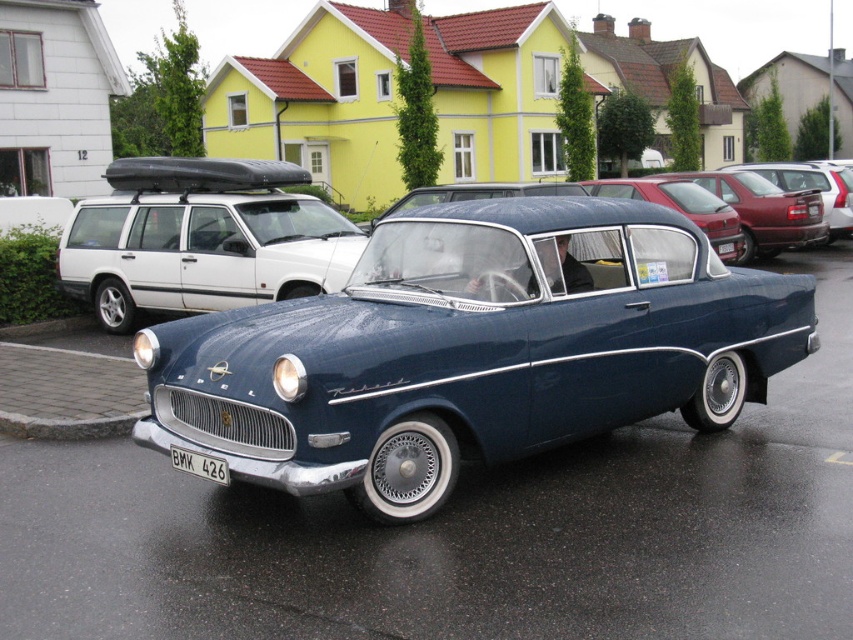
You are a delivery person trying to park your van next to the vintage Opel car. You see the matte red station wagon at right and the white plastic license plate at center. Which object should you avoid hitting to prevent damage since it is smaller?

You should avoid hitting the white plastic license plate at center because it is smaller than the matte red station wagon at right.

You are a delivery drone trying to land on the roof of the metallic blue sedan at center. The landing pad coordinates are at point 0.5, 0.5. Can you land safely?

The metallic blue sedan at center is located at point (763,211), which is not at the landing pad coordinates of (426,320). Therefore, you cannot land safely there.

You are a delivery person trying to read the license plate of the white plastic license plate at center. However, the matte red station wagon at right is blocking your view. Can you move around the car to get a clear view of the license plate?

The white plastic license plate at center is behind the matte red station wagon at right, so moving around the car to the left side might allow you to see the license plate clearly.